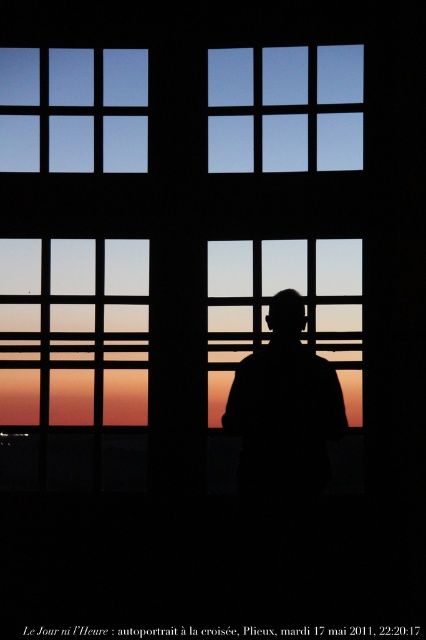
Is transparent glass window at center thinner than black matte figure at center?

No.

Is transparent glass window at center behind black matte figure at center?

Yes.

Is point (322, 323) closer to camera compared to point (288, 406)?

No, it is behind (288, 406).

The height and width of the screenshot is (640, 426). What are the coordinates of `transparent glass window at center` in the screenshot? It's located at (267, 307).

Which of these two, transparent glass window at upper center or transparent glass window at upper left, stands shorter?

With less height is transparent glass window at upper left.

Is transparent glass window at upper center to the right of transparent glass window at upper left from the viewer's perspective?

Yes, transparent glass window at upper center is to the right of transparent glass window at upper left.

Which is behind, point (281, 97) or point (126, 152)?

The point (281, 97) is more distant.

Locate an element on the screen. The height and width of the screenshot is (640, 426). transparent glass window at upper center is located at coordinates (284, 108).

Does transparent glass window at upper left have a larger size compared to black matte figure at center?

No, transparent glass window at upper left is not bigger than black matte figure at center.

Where is `transparent glass window at upper left`? transparent glass window at upper left is located at coordinates (74, 109).